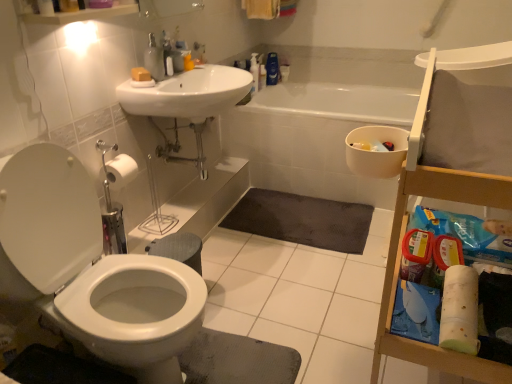
What is the approximate width of translucent plastic bottle at upper center, acting as the second toiletry starting from the front?

translucent plastic bottle at upper center, acting as the second toiletry starting from the front, is 2.16 inches wide.

Measure the distance between point (156, 77) and camera.

Point (156, 77) is 5.94 feet away from camera.

What do you see at coordinates (188, 93) in the screenshot? I see `white glossy sink at upper center` at bounding box center [188, 93].

Measure the distance between point (181,75) and camera.

Point (181,75) is 1.91 meters away from camera.

Image resolution: width=512 pixels, height=384 pixels. I want to click on yellow matte soap at upper center, so click(x=140, y=74).

In terms of size, does white glossy sink at upper center appear bigger or smaller than yellow matte soap at upper center?

white glossy sink at upper center is bigger than yellow matte soap at upper center.

Is white glossy sink at upper center situated inside yellow matte soap at upper center or outside?

white glossy sink at upper center is not enclosed by yellow matte soap at upper center.

Are white glossy sink at upper center and yellow matte soap at upper center beside each other?

No.

Considering the sizes of objects white textured towel at lower right and white glossy toilet at left in the image provided, who is wider, white textured towel at lower right or white glossy toilet at left?

white glossy toilet at left.

Which is closer, (465, 335) or (196, 315)?

Point (465, 335) appears to be closer to the viewer than point (196, 315).

Considering the relative positions of white textured towel at lower right and white glossy toilet at left in the image provided, is white textured towel at lower right to the left of white glossy toilet at left from the viewer's perspective?

Incorrect, white textured towel at lower right is not on the left side of white glossy toilet at left.

Could you tell me if white textured towel at lower right is facing white glossy toilet at left?

Yes, white textured towel at lower right is oriented towards white glossy toilet at left.

From a real-world perspective, is white textured towel at lower right positioned over dark gray textured bath mat at center based on gravity?

Yes, from a real-world perspective, white textured towel at lower right is on top of dark gray textured bath mat at center.

Is white textured towel at lower right not close to dark gray textured bath mat at center?

That's right, there is a large distance between white textured towel at lower right and dark gray textured bath mat at center.

Locate an element on the screen. toilet paper that is below the dark gray textured bath mat at center (from the image's perspective) is located at coordinates (460, 310).

Is white textured towel at lower right behind dark gray textured bath mat at center?

That is False.

Between point (250, 69) and point (468, 340), which one is positioned in front?

The point (468, 340) is closer.

Can white textured towel at lower right be found inside translucent plastic bottle at upper center, the 2th cleaning product viewed from the right?

Actually, white textured towel at lower right is outside translucent plastic bottle at upper center, the 2th cleaning product viewed from the right.

Does translucent plastic bottle at upper center, the 2th cleaning product viewed from the right, touch white textured towel at lower right?

They are not placed beside each other.

Who is smaller, metallic silver pipes at center or white textured towel at lower right?

white textured towel at lower right.

Consider the image. From the image's perspective, is metallic silver pipes at center above white textured towel at lower right?

Indeed, from the image's perspective, metallic silver pipes at center is shown above white textured towel at lower right.

Which object is closer to the camera taking this photo, metallic silver pipes at center or white textured towel at lower right?

white textured towel at lower right is in front.

Considering the sizes of metallic silver pipes at center and white textured towel at lower right in the image, is metallic silver pipes at center taller or shorter than white textured towel at lower right?

In the image, metallic silver pipes at center appears to be taller than white textured towel at lower right.

Are dark gray textured bath mat at center and metallic silver pipes at center far apart?

dark gray textured bath mat at center is near metallic silver pipes at center, not far away.

Relative to metallic silver pipes at center, is dark gray textured bath mat at center in front or behind?

Visually, dark gray textured bath mat at center is located behind metallic silver pipes at center.

Is dark gray textured bath mat at center turned away from metallic silver pipes at center?

No.

Can you tell me how much dark gray textured bath mat at center and metallic silver pipes at center differ in facing direction?

They differ by 90.3 degrees in their facing directions.

Is translucent plastic soap dispenser at upper center, positioned as the 2th toiletry in right-to-left order, to the left or to the right of translucent plastic bottle at upper center, the 1th toiletry from the top, in the image?

translucent plastic soap dispenser at upper center, positioned as the 2th toiletry in right-to-left order, is to the left of translucent plastic bottle at upper center, the 1th toiletry from the top.

From a real-world perspective, does translucent plastic soap dispenser at upper center, which is the 2th toiletry in top-to-bottom order, stand above translucent plastic bottle at upper center, acting as the second toiletry starting from the front?

Indeed, from a real-world perspective, translucent plastic soap dispenser at upper center, which is the 2th toiletry in top-to-bottom order, stands above translucent plastic bottle at upper center, acting as the second toiletry starting from the front.

Is translucent plastic soap dispenser at upper center, which is the 2th toiletry in top-to-bottom order, not close to translucent plastic bottle at upper center, which is counted as the 1th toiletry, starting from the right?

Absolutely, translucent plastic soap dispenser at upper center, which is the 2th toiletry in top-to-bottom order, is distant from translucent plastic bottle at upper center, which is counted as the 1th toiletry, starting from the right.

Is translucent plastic soap dispenser at upper center, positioned as the second toiletry in back-to-front order, completely or partially outside of translucent plastic bottle at upper center, marked as the 2th toiletry in a left-to-right arrangement?

Yes, translucent plastic soap dispenser at upper center, positioned as the second toiletry in back-to-front order, is located beyond the bounds of translucent plastic bottle at upper center, marked as the 2th toiletry in a left-to-right arrangement.

This screenshot has height=384, width=512. Find the location of `soap lying above the white glossy sink at upper center (from the image's perspective)`. soap lying above the white glossy sink at upper center (from the image's perspective) is located at coordinates (140, 74).

Find the location of a particular element. toilet paper below the white glossy toilet at left (from a real-world perspective) is located at coordinates (460, 310).

Estimate the real-world distances between objects in this image. Which object is further from translucent plastic bottle at upper center, the 1th toiletry from the top, dark gray textured bath mat at center or white glossy sink at upper center?

white glossy sink at upper center is further to translucent plastic bottle at upper center, the 1th toiletry from the top.

Based on their spatial positions, is blue glossy bottle at upper center, positioned as the first cleaning product in right-to-left order, or yellow matte soap at upper center further from white glossy sink at upper center?

Based on the image, blue glossy bottle at upper center, positioned as the first cleaning product in right-to-left order, appears to be further to white glossy sink at upper center.

Based on their spatial positions, is metallic silver pipes at center or dark gray textured bath mat at center closer to white glossy sink at upper center?

metallic silver pipes at center is closer to white glossy sink at upper center.

Based on their spatial positions, is white textured towel at lower right or white glossy toilet at left further from translucent plastic bottle at upper center, the 2th cleaning product viewed from the right?

white textured towel at lower right is positioned further to the anchor translucent plastic bottle at upper center, the 2th cleaning product viewed from the right.

When comparing their distances from dark gray textured bath mat at center, does blue glossy bottle at upper center, positioned as the first cleaning product in right-to-left order, or white glossy toilet at left seem further?

white glossy toilet at left.

Considering their positions, is dark gray textured bath mat at center positioned further to blue glossy bottle at upper center, which is the second cleaning product from left to right, than translucent plastic soap dispenser at upper center, marked as the first toiletry in a front-to-back arrangement?

translucent plastic soap dispenser at upper center, marked as the first toiletry in a front-to-back arrangement.

Estimate the real-world distances between objects in this image. Which object is closer to metallic silver pipes at center, translucent plastic bottle at upper center, the 2th cleaning product viewed from the right, or dark gray textured bath mat at center?

Among the two, dark gray textured bath mat at center is located nearer to metallic silver pipes at center.

Which object lies further to the anchor point white glossy toilet at left, white textured towel at lower right or metallic silver pipes at center?

Among the two, white textured towel at lower right is located further to white glossy toilet at left.

The width and height of the screenshot is (512, 384). I want to click on bath mat between white textured towel at lower right and translucent plastic bottle at upper center, acting as the second toiletry starting from the front, along the z-axis, so click(x=302, y=220).

Where is `bath between yellow matte soap at upper center and translucent plastic bottle at upper center, which ranks as the first cleaning product in left-to-right order, in the front-back direction`? bath between yellow matte soap at upper center and translucent plastic bottle at upper center, which ranks as the first cleaning product in left-to-right order, in the front-back direction is located at coordinates (314, 137).

At what (x,y) coordinates should I click in order to perform the action: click on bath positioned between white textured towel at lower right and translucent plastic bottle at upper center, the 1th toiletry from the top, from near to far. Please return your answer as a coordinate pair (x, y). Image resolution: width=512 pixels, height=384 pixels. Looking at the image, I should click on (314, 137).

Find the location of a particular element. This screenshot has width=512, height=384. bath mat between translucent plastic soap dispenser at upper center, which is the 1th toiletry in left-to-right order, and translucent plastic bottle at upper center, which is counted as the 1th toiletry, starting from the right, from front to back is located at coordinates (302, 220).